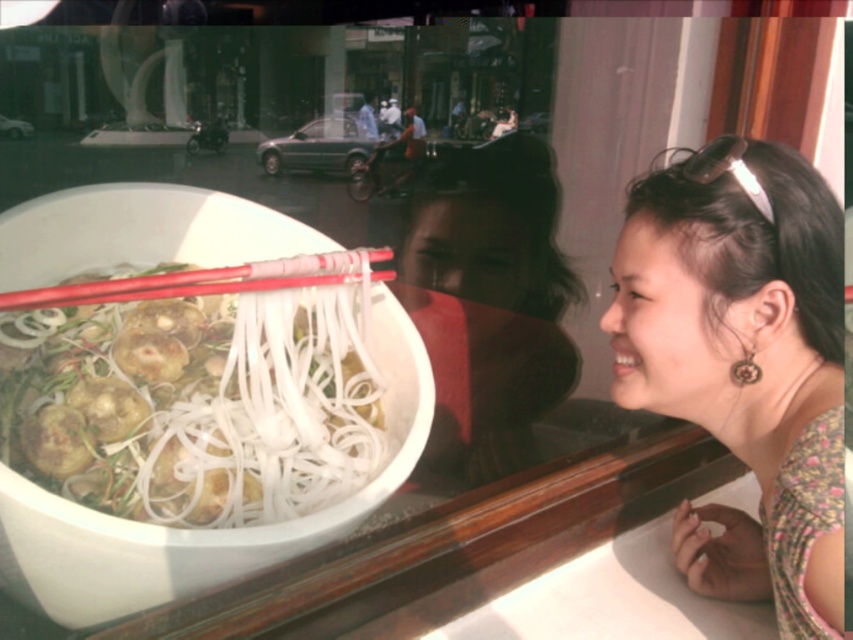
Question: Estimate the real-world distances between objects in this image. Which object is farther from the white matte noodles at center?

Choices:
 (A) matte black hair at upper center
 (B) floral fabric headband at upper right

Answer: (A)

Question: Is matte black hair at upper center further to camera compared to red plastic chopsticks at center?

Choices:
 (A) yes
 (B) no

Answer: (A)

Question: Does white matte noodles at center appear under red plastic chopsticks at center?

Choices:
 (A) no
 (B) yes

Answer: (B)

Question: Among these objects, which one is nearest to the camera?

Choices:
 (A) white matte noodles at center
 (B) red plastic chopsticks at center
 (C) matte black hair at upper center
 (D) floral fabric headband at upper right

Answer: (D)

Question: Is matte black hair at upper center smaller than red plastic chopsticks at center?

Choices:
 (A) yes
 (B) no

Answer: (B)

Question: Which point is farther to the camera?

Choices:
 (A) (7, 298)
 (B) (247, 326)
 (C) (503, 225)

Answer: (C)